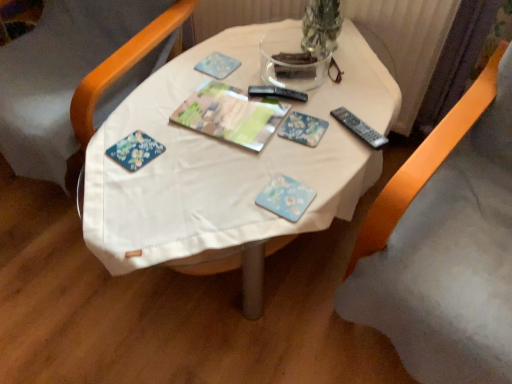
This screenshot has width=512, height=384. What are the coordinates of `free space above white fabric table at center (from a real-world perspective)` in the screenshot? It's located at (244, 115).